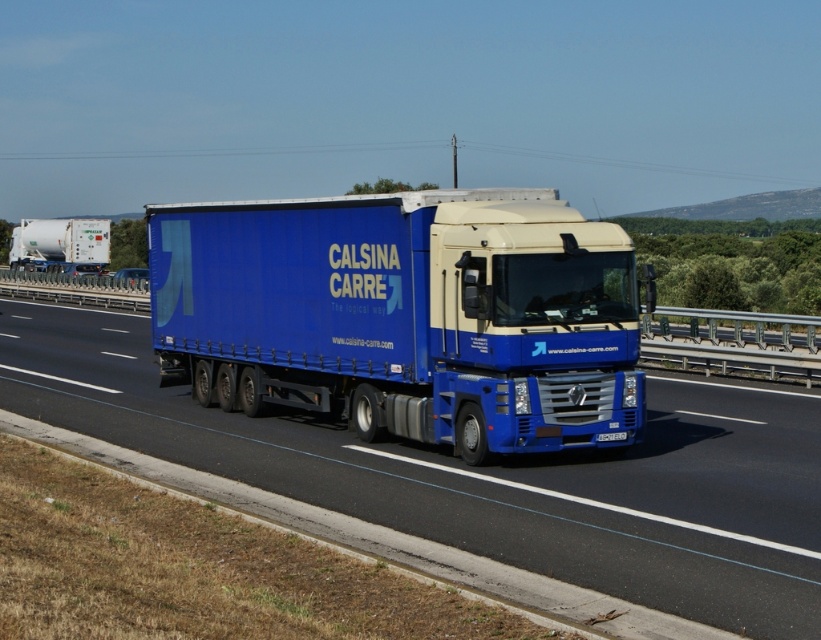
You are a photographer standing at the camera position. You want to take a photo of the blue semi truck in the foreground. There are two points marked on your viewfinder at coordinates point (585, 435) and point (56, 422). Which point is closer to you?

Point (585, 435) is closer to the camera than point (56, 422).

You are a photographer trying to capture both the blue metallic truck at center and the white matte tank at left in a single shot. Based on their sizes in the image, which one would you need to move closer to the camera to ensure they appear the same size in the photo?

The blue metallic truck at center is smaller than the white matte tank at left in the image, so you would need to move the blue metallic truck at center closer to the camera to make them appear the same size.